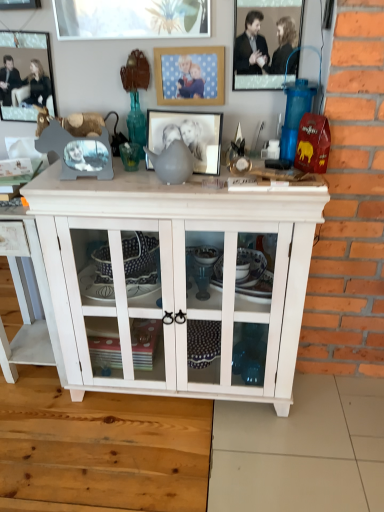
At what (x,y) coordinates should I click in order to perform the action: click on vacant region above white wood cabinet at center, acting as the 2th table starting from the left (from a real-world perspective). Please return your answer as a coordinate pair (x, y). Image resolution: width=384 pixels, height=512 pixels. Looking at the image, I should click on (192, 172).